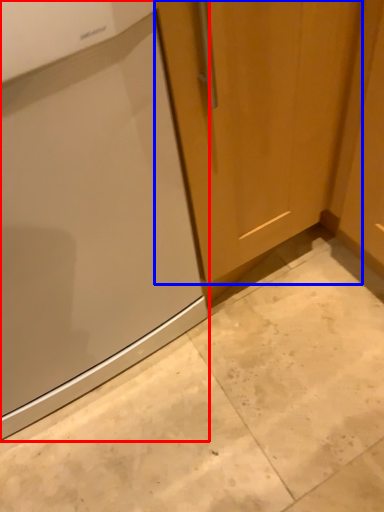
Question: Which object is further to the camera taking this photo, home appliance (highlighted by a red box) or door (highlighted by a blue box)?

Choices:
 (A) home appliance
 (B) door

Answer: (B)